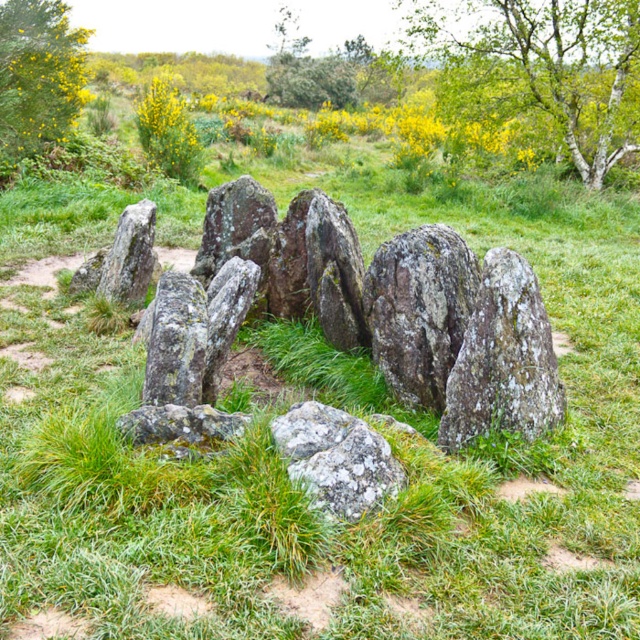
You are an archaeologist examining the prehistoric site. You notice the mossy stone circle at center and the rough gray rock at left. Which object is taller?

The mossy stone circle at center is taller than the rough gray rock at left.